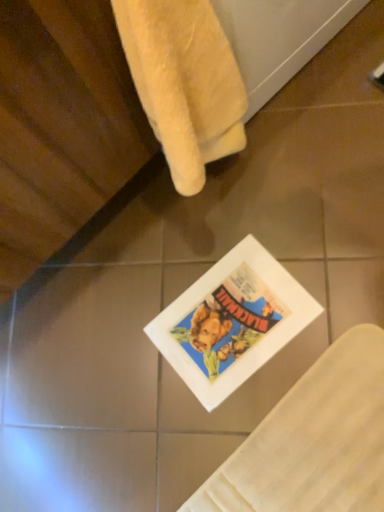
Find the location of a particular element. free location to the left of matte paper comic book at center is located at coordinates (135, 391).